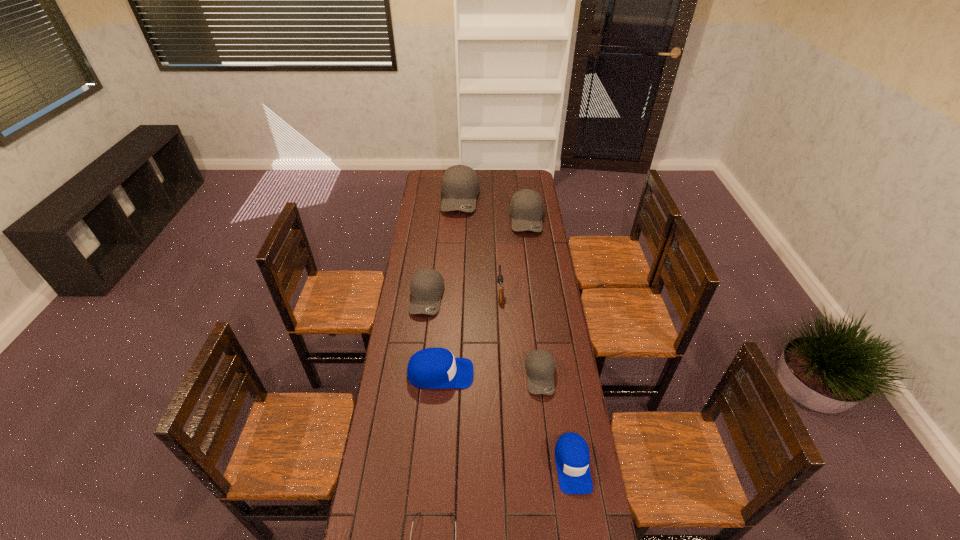
Locate an element on the screen. The width and height of the screenshot is (960, 540). the biggest gray baseball cap is located at coordinates (460, 186).

The image size is (960, 540). In order to click on the tallest baseball cap in this screenshot , I will do `click(460, 186)`.

The image size is (960, 540). What are the coordinates of `the second tallest object` in the screenshot? It's located at (526, 207).

At what (x,y) coordinates should I click in order to perform the action: click on the second biggest gray baseball cap. Please return your answer as a coordinate pair (x, y). This screenshot has height=540, width=960. Looking at the image, I should click on (526, 207).

Identify the location of the fourth nearest baseball cap. (427, 285).

This screenshot has width=960, height=540. What are the coordinates of `the third farthest gray baseball cap` in the screenshot? It's located at (427, 285).

Find the location of a particular element. Image resolution: width=960 pixels, height=540 pixels. the fifth object from left to right is located at coordinates (500, 278).

You are a GUI agent. You are given a task and a screenshot of the screen. Output one action in this format:
    pyautogui.click(x=<x>, y=<y>)
    Task: Click on the black gun
    
    Given the screenshot: What is the action you would take?
    pyautogui.click(x=500, y=278)

This screenshot has width=960, height=540. Find the location of `the farther blue baseball cap`. the farther blue baseball cap is located at coordinates (432, 368).

Where is `the left blue baseball cap`? the left blue baseball cap is located at coordinates (432, 368).